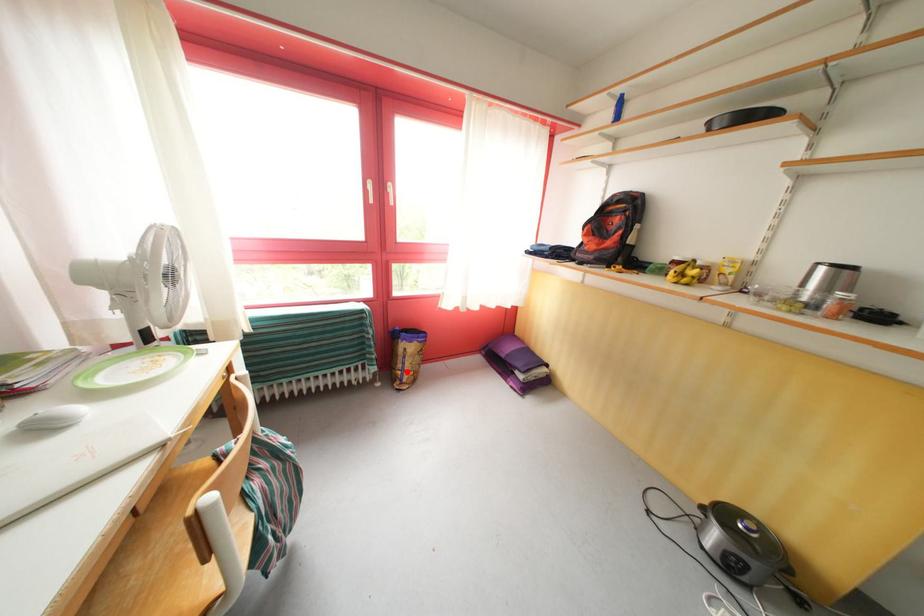
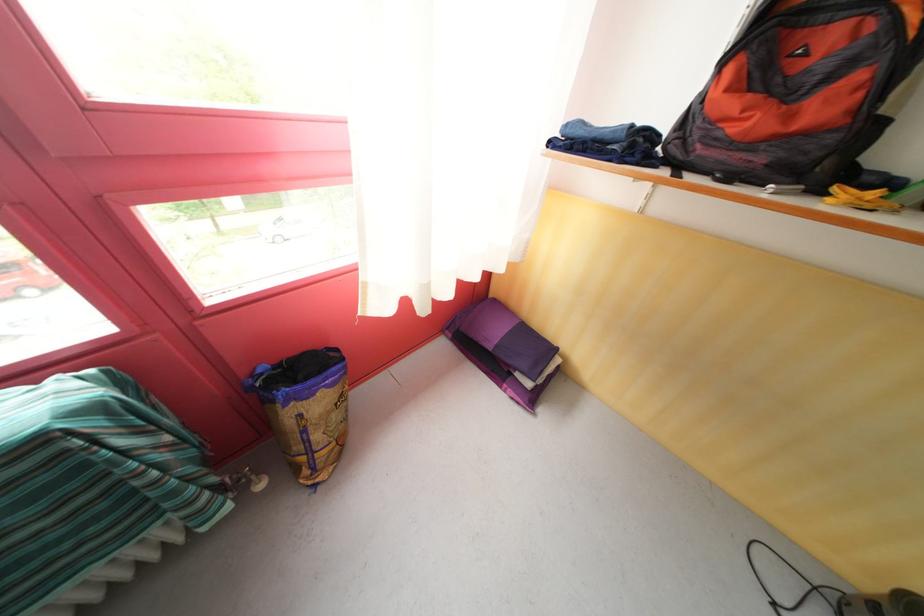
Locate, in the second image, the point that corresponds to the highlighted location in the first image.

(305, 454)